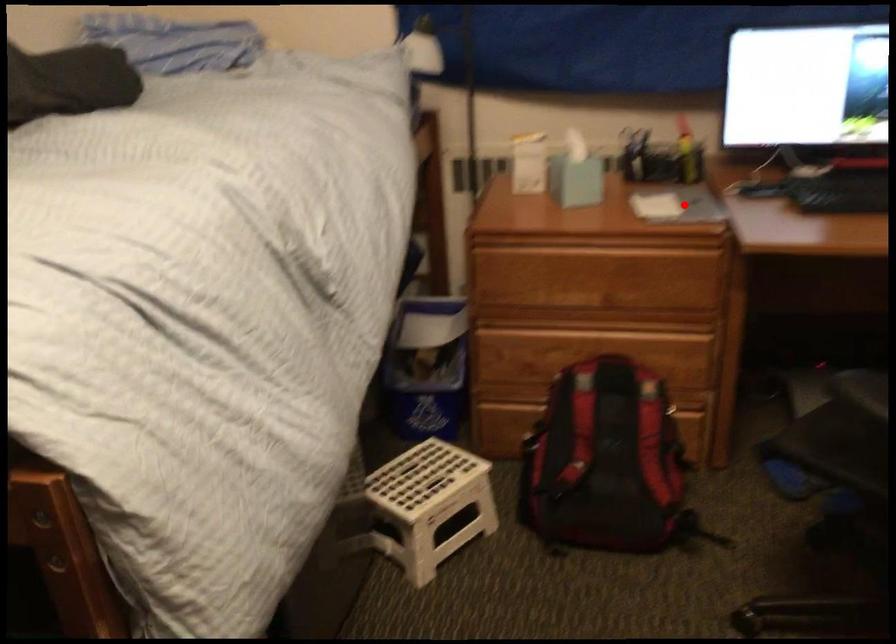
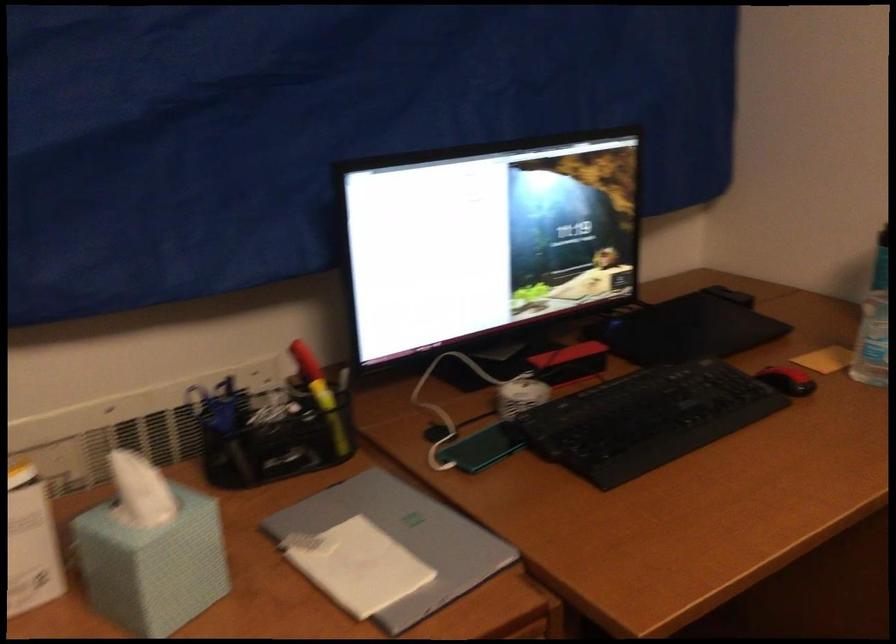
Where in the second image is the point corresponding to the highlighted location from the first image?

(403, 538)